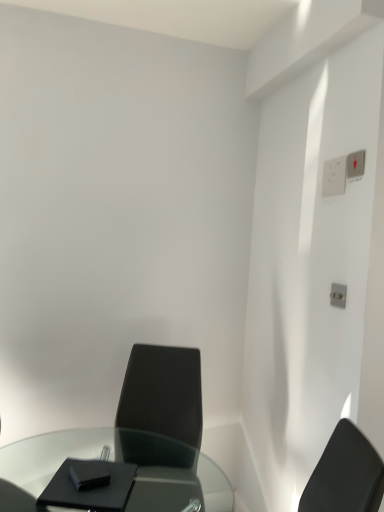
Where is `transparent glass table at lower left`? transparent glass table at lower left is located at coordinates (117, 462).

This screenshot has width=384, height=512. I want to click on matte black chair at center, so click(163, 393).

Locate an element on the screen. white plastic electric outlet at upper right, the 1th electric outlet in the back-to-front sequence is located at coordinates (334, 177).

Considering the sizes of white plastic switch at upper right, the 2th electric outlet positioned from the back, and white plastic electric outlet at upper right, the 2th electric outlet in the front-to-back sequence, in the image, is white plastic switch at upper right, the 2th electric outlet positioned from the back, taller or shorter than white plastic electric outlet at upper right, the 2th electric outlet in the front-to-back sequence,?

white plastic switch at upper right, the 2th electric outlet positioned from the back, is shorter than white plastic electric outlet at upper right, the 2th electric outlet in the front-to-back sequence.

From the image's perspective, is white plastic switch at upper right, the 2th electric outlet positioned from the back, on white plastic electric outlet at upper right, the 2th electric outlet in the front-to-back sequence?

Yes, from the image's perspective, white plastic switch at upper right, the 2th electric outlet positioned from the back, is over white plastic electric outlet at upper right, the 2th electric outlet in the front-to-back sequence.

Which object is further away from the camera taking this photo, white plastic switch at upper right, the 2th electric outlet positioned from the back, or white plastic electric outlet at upper right, the 2th electric outlet in the front-to-back sequence?

white plastic electric outlet at upper right, the 2th electric outlet in the front-to-back sequence, is further from the camera.

Can you tell me how much white plastic switch at upper right, the 2th electric outlet positioned from the back, and white plastic electric outlet at upper right, the 2th electric outlet in the front-to-back sequence, differ in facing direction?

There is a 0.00262-degree angle between the facing directions of white plastic switch at upper right, the 2th electric outlet positioned from the back, and white plastic electric outlet at upper right, the 2th electric outlet in the front-to-back sequence.

Where is `table on the left of white plastic electric outlet at upper right, the 1th electric outlet in the back-to-front sequence`? table on the left of white plastic electric outlet at upper right, the 1th electric outlet in the back-to-front sequence is located at coordinates (117, 462).

Measure the distance between transparent glass table at lower left and white plastic electric outlet at upper right, the 1th electric outlet in the back-to-front sequence.

transparent glass table at lower left and white plastic electric outlet at upper right, the 1th electric outlet in the back-to-front sequence, are 1.53 meters apart.

Is point (87, 458) positioned after point (333, 190)?

Yes, it is behind point (333, 190).

Is transparent glass table at lower left inside or outside of white plastic electric outlet at upper right, the 1th electric outlet in the back-to-front sequence?

transparent glass table at lower left exists outside the volume of white plastic electric outlet at upper right, the 1th electric outlet in the back-to-front sequence.

From a real-world perspective, which is physically below, white plastic electric outlet at upper right, the 1th electric outlet in the back-to-front sequence, or transparent glass table at lower left?

In real-world perspective, transparent glass table at lower left is lower.

How different are the orientations of white plastic electric outlet at upper right, the 2th electric outlet in the front-to-back sequence, and transparent glass table at lower left in degrees?

The facing directions of white plastic electric outlet at upper right, the 2th electric outlet in the front-to-back sequence, and transparent glass table at lower left are 89.6 degrees apart.

Considering the positions of point (327, 193) and point (66, 433), is point (327, 193) closer or farther from the camera than point (66, 433)?

Clearly, point (327, 193) is closer to the camera than point (66, 433).

Are white plastic electric outlet at upper right, the 1th electric outlet in the back-to-front sequence, and transparent glass table at lower left located far from each other?

Indeed, white plastic electric outlet at upper right, the 1th electric outlet in the back-to-front sequence, is not near transparent glass table at lower left.

From a real-world perspective, between white plastic electric outlet at upper right, the 2th electric outlet in the front-to-back sequence, and white plastic switch at upper right, the 1th electric outlet positioned from the front, who is vertically higher?

white plastic switch at upper right, the 1th electric outlet positioned from the front.

Between point (329, 170) and point (351, 174), which one is positioned behind?

Positioned behind is point (329, 170).

Is white plastic electric outlet at upper right, the 1th electric outlet in the back-to-front sequence, next to white plastic switch at upper right, the 1th electric outlet positioned from the front, and touching it?

Yes.

Relative to white plastic switch at upper right, the 1th electric outlet positioned from the front, is white plastic electric outlet at upper right, the 2th electric outlet in the front-to-back sequence, in front or behind?

white plastic electric outlet at upper right, the 2th electric outlet in the front-to-back sequence, is behind white plastic switch at upper right, the 1th electric outlet positioned from the front.

From a real-world perspective, is white plastic switch at upper right, the 1th electric outlet positioned from the front, over transparent glass table at lower left?

Correct, in the physical world, white plastic switch at upper right, the 1th electric outlet positioned from the front, is higher than transparent glass table at lower left.

Is the depth of white plastic switch at upper right, the 1th electric outlet positioned from the front, less than that of transparent glass table at lower left?

No, it is not.

Is white plastic switch at upper right, the 2th electric outlet positioned from the back, at the right side of transparent glass table at lower left?

Yes, white plastic switch at upper right, the 2th electric outlet positioned from the back, is to the right of transparent glass table at lower left.

Is white plastic switch at upper right, the 2th electric outlet positioned from the back, not within transparent glass table at lower left?

Absolutely, white plastic switch at upper right, the 2th electric outlet positioned from the back, is external to transparent glass table at lower left.

Which object is more forward, transparent glass table at lower left or matte black chair at center?

transparent glass table at lower left.

Which object is thinner, transparent glass table at lower left or matte black chair at center?

With smaller width is matte black chair at center.

Is transparent glass table at lower left smaller than matte black chair at center?

Actually, transparent glass table at lower left might be larger than matte black chair at center.

Does white plastic electric outlet at upper right, the 2th electric outlet in the front-to-back sequence, touch matte black chair at center?

white plastic electric outlet at upper right, the 2th electric outlet in the front-to-back sequence, and matte black chair at center are not in contact.

Can you confirm if white plastic electric outlet at upper right, the 2th electric outlet in the front-to-back sequence, is thinner than matte black chair at center?

Correct, the width of white plastic electric outlet at upper right, the 2th electric outlet in the front-to-back sequence, is less than that of matte black chair at center.

How far apart are white plastic electric outlet at upper right, the 1th electric outlet in the back-to-front sequence, and matte black chair at center?

The distance of white plastic electric outlet at upper right, the 1th electric outlet in the back-to-front sequence, from matte black chair at center is 3.69 feet.

What's the angular difference between white plastic electric outlet at upper right, the 1th electric outlet in the back-to-front sequence, and matte black chair at center's facing directions?

The facing directions of white plastic electric outlet at upper right, the 1th electric outlet in the back-to-front sequence, and matte black chair at center are 69.9 degrees apart.

Locate an element on the screen. The image size is (384, 512). electric outlet in front of the white plastic electric outlet at upper right, the 2th electric outlet in the front-to-back sequence is located at coordinates (355, 164).

Starting from the transparent glass table at lower left, which electric outlet is the 1st one to the right? Please provide its 2D coordinates.

[(334, 177)]

When comparing their distances from transparent glass table at lower left, does matte black chair at center or white plastic electric outlet at upper right, the 2th electric outlet in the front-to-back sequence, seem closer?

matte black chair at center is closer to transparent glass table at lower left.

Estimate the real-world distances between objects in this image. Which object is further from white plastic electric outlet at upper right, the 1th electric outlet in the back-to-front sequence, transparent glass table at lower left or matte black chair at center?

Based on the image, transparent glass table at lower left appears to be further to white plastic electric outlet at upper right, the 1th electric outlet in the back-to-front sequence.

Estimate the real-world distances between objects in this image. Which object is closer to matte black chair at center, white plastic switch at upper right, the 2th electric outlet positioned from the back, or white plastic electric outlet at upper right, the 2th electric outlet in the front-to-back sequence?

Among the two, white plastic electric outlet at upper right, the 2th electric outlet in the front-to-back sequence, is located nearer to matte black chair at center.

Considering their positions, is transparent glass table at lower left positioned closer to matte black chair at center than white plastic electric outlet at upper right, the 1th electric outlet in the back-to-front sequence?

transparent glass table at lower left is positioned closer to the anchor matte black chair at center.

In the scene shown: When comparing their distances from white plastic switch at upper right, the 2th electric outlet positioned from the back, does white plastic electric outlet at upper right, the 1th electric outlet in the back-to-front sequence, or transparent glass table at lower left seem further?

Among the two, transparent glass table at lower left is located further to white plastic switch at upper right, the 2th electric outlet positioned from the back.

From the image, which object appears to be farther from white plastic switch at upper right, the 1th electric outlet positioned from the front, transparent glass table at lower left or white plastic electric outlet at upper right, the 1th electric outlet in the back-to-front sequence?

Based on the image, transparent glass table at lower left appears to be further to white plastic switch at upper right, the 1th electric outlet positioned from the front.

Looking at the image, which one is located closer to matte black chair at center, white plastic electric outlet at upper right, the 2th electric outlet in the front-to-back sequence, or white plastic switch at upper right, the 2th electric outlet positioned from the back?

Among the two, white plastic electric outlet at upper right, the 2th electric outlet in the front-to-back sequence, is located nearer to matte black chair at center.

Based on the photo, based on their spatial positions, is white plastic switch at upper right, the 1th electric outlet positioned from the front, or transparent glass table at lower left closer to matte black chair at center?

Among the two, transparent glass table at lower left is located nearer to matte black chair at center.

Where is `electric outlet between white plastic switch at upper right, the 2th electric outlet positioned from the back, and matte black chair at center, in the vertical direction`? electric outlet between white plastic switch at upper right, the 2th electric outlet positioned from the back, and matte black chair at center, in the vertical direction is located at coordinates (334, 177).

Where is `electric outlet between white plastic switch at upper right, the 2th electric outlet positioned from the back, and transparent glass table at lower left vertically`? electric outlet between white plastic switch at upper right, the 2th electric outlet positioned from the back, and transparent glass table at lower left vertically is located at coordinates (334, 177).

Where is `chair between white plastic electric outlet at upper right, the 2th electric outlet in the front-to-back sequence, and transparent glass table at lower left from top to bottom`? chair between white plastic electric outlet at upper right, the 2th electric outlet in the front-to-back sequence, and transparent glass table at lower left from top to bottom is located at coordinates pos(163,393).

Where is `chair between white plastic switch at upper right, the 2th electric outlet positioned from the back, and transparent glass table at lower left vertically`? chair between white plastic switch at upper right, the 2th electric outlet positioned from the back, and transparent glass table at lower left vertically is located at coordinates (163, 393).